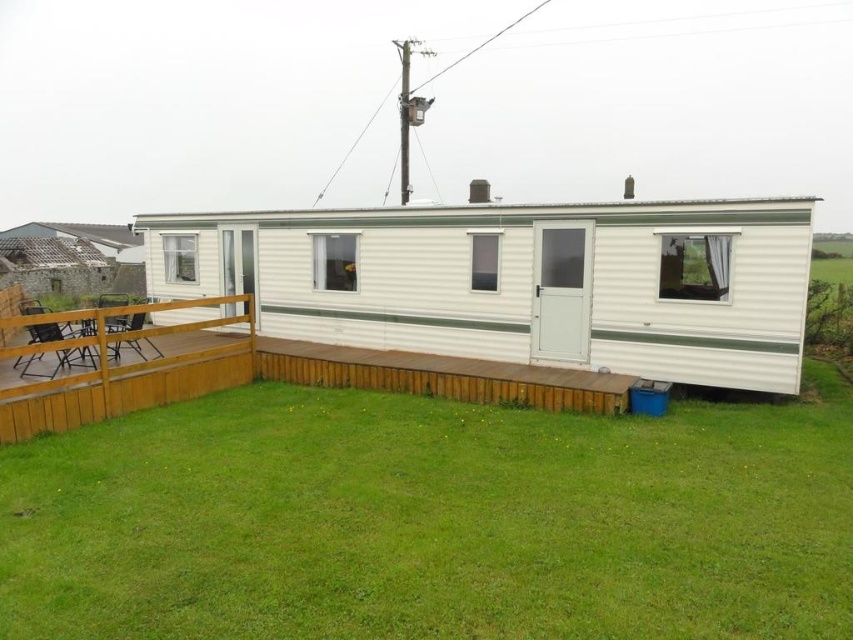
You are standing at the point marked as point (432, 520) in the image. What is the surface you are currently standing on?

The point (432, 520) is on green grass at lower center, so you are standing on green grass.

You are standing on the brown wooden deck at lower left and want to reach the green grass at lower center. Which direction should you move to get there?

Since the green grass at lower center is located below the brown wooden deck at lower left, you should move downward from the brown wooden deck at lower left to reach the green grass at lower center.

You are standing on the brown wooden deck at lower left and want to walk to the white corrugated metal trailer at center. Which direction should you move to reach it?

Since the brown wooden deck at lower left is behind the white corrugated metal trailer at center, you should move forward towards the trailer to reach it.